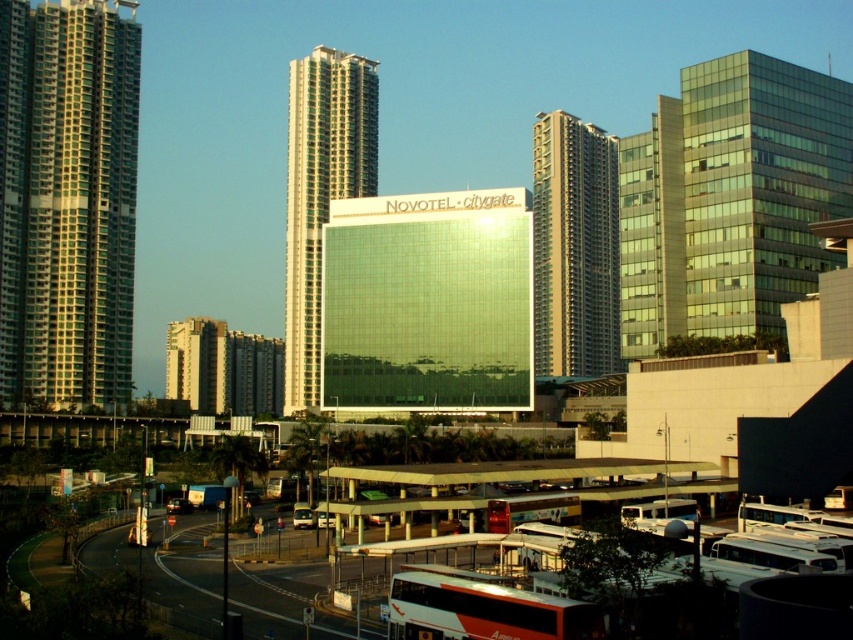
You are a delivery drone that needs to fly from the white plastic bus at lower center to the green glass building at left. The minimum safe flying distance between obstacles is 200 feet. Can you safely make this flight without coming closer than 200 feet to any obstacles?

The green glass building at left is 305.59 feet from the white plastic bus at lower center. Since the minimum safe distance is 200 feet, the drone can safely fly between them as the distance is sufficient.

You are a drone operator who needs to fly a drone from your current position to capture a photo of the gold glass tower at center. The drone has a maximum flight range of 120 meters. Based on the scene, will the drone be able to reach the tower?

The distance between the gold glass tower at center and the camera is 123.71 meters, which exceeds the drone operator has a maximum flight range of 120 meters. Therefore, the drone will not be able to reach the tower.

You are a drone operator who needs to fly a drone from the glassy reflective building at upper right to the red matte bus at center. Given that the drone has a maximum flight range of 200 feet, will it be able to reach the bus without needing a recharge?

The glassy reflective building at upper right and the red matte bus at center are 203.89 feet apart from each other. Since the drone can only fly 200 feet before needing a recharge, it will not be able to reach the bus without recharging.